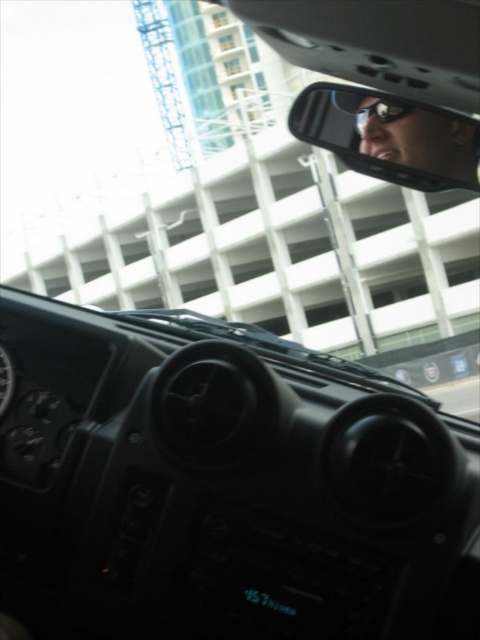
Between clear plastic rearview mirror at upper center and matte black goggles at upper center, which one has less height?

With less height is matte black goggles at upper center.

Is point (388, 109) closer to viewer compared to point (389, 109)?

No, (388, 109) is behind (389, 109).

Find the location of a particular element. The width and height of the screenshot is (480, 640). clear plastic rearview mirror at upper center is located at coordinates (389, 134).